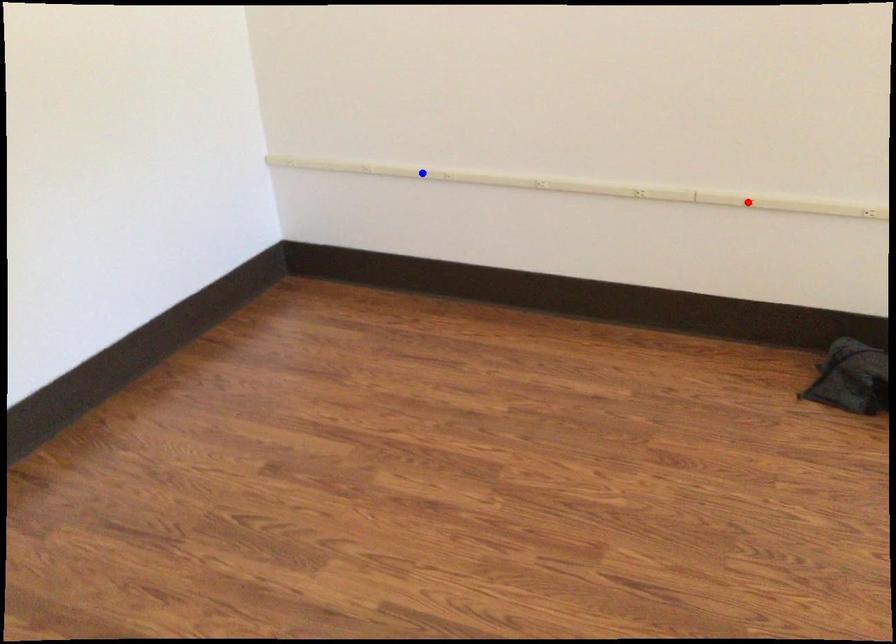
Question: Which of the two points in the image is closer to the camera?

Choices:
 (A) Blue point is closer.
 (B) Red point is closer.

Answer: (B)